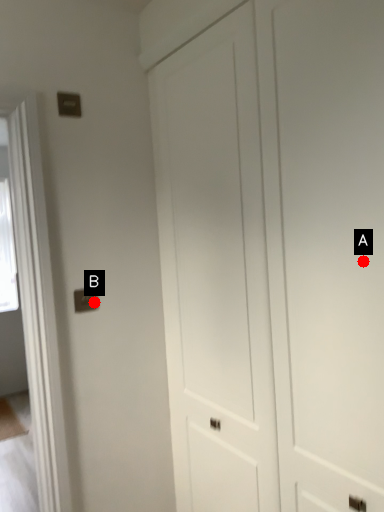
Question: Two points are circled on the image, labeled by A and B beside each circle. Which point appears closest to the camera in this image?

Choices:
 (A) A is closer
 (B) B is closer

Answer: (A)